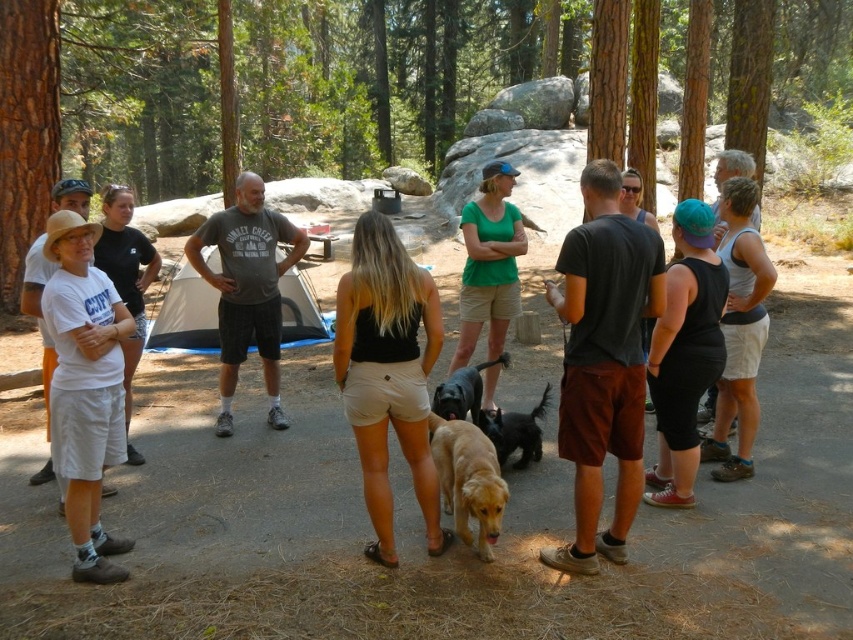
Consider the image. You are standing at the edge of the campsite and see the golden fur dog at center. If you want to walk directly towards the dog, which direction should you move in?

Since the golden fur dog at center is located at point (515, 432), you should move towards the center of the campsite to reach it.